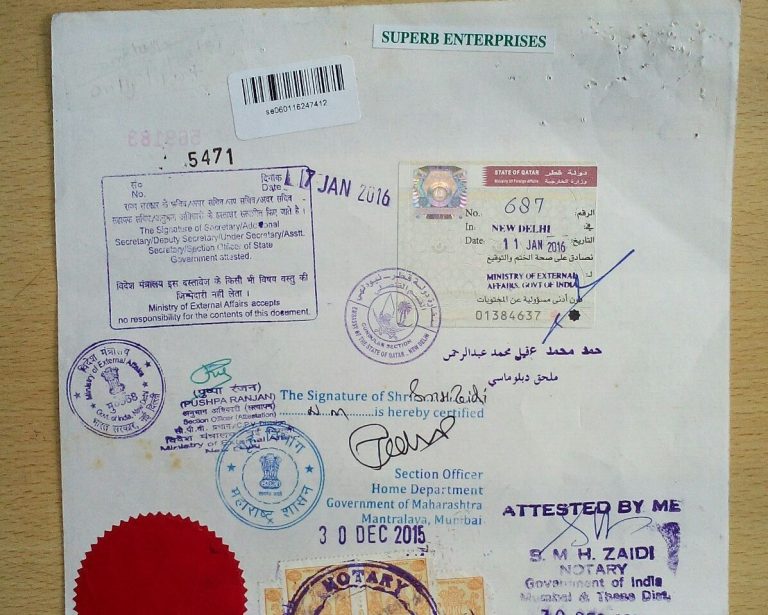
Where is `table`? This screenshot has width=768, height=615. table is located at coordinates (30, 501), (747, 426).